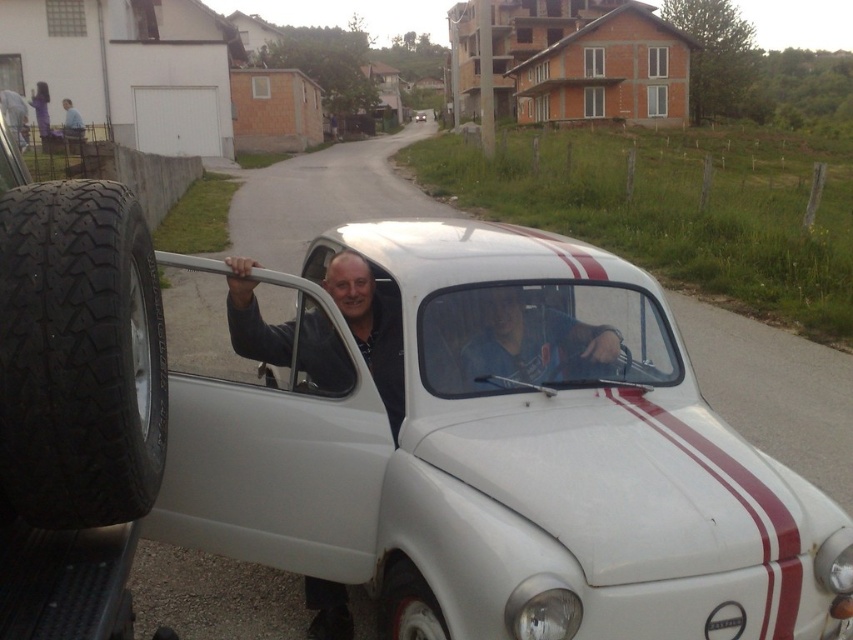
Question: Considering the relative positions of white rubber tire at lower center and purple fabric dress at upper left in the image provided, where is white rubber tire at lower center located with respect to purple fabric dress at upper left?

Choices:
 (A) above
 (B) below

Answer: (B)

Question: Estimate the real-world distances between objects in this image. Which object is farther from the black rubber tire at left?

Choices:
 (A) purple fabric dress at upper left
 (B) white rubber tire at lower center

Answer: (A)

Question: Based on their relative distances, which object is nearer to the black rubber tire at left?

Choices:
 (A) white rubber tire at lower center
 (B) white matte car at center

Answer: (A)

Question: Where is black rubber tire at left located in relation to white matte car at center in the image?

Choices:
 (A) above
 (B) below

Answer: (B)

Question: Can you confirm if white rubber tire at lower center is positioned to the left of purple fabric dress at upper left?

Choices:
 (A) yes
 (B) no

Answer: (B)

Question: Which object is farther from the camera taking this photo?

Choices:
 (A) white matte car at center
 (B) white rubber tire at lower center

Answer: (A)